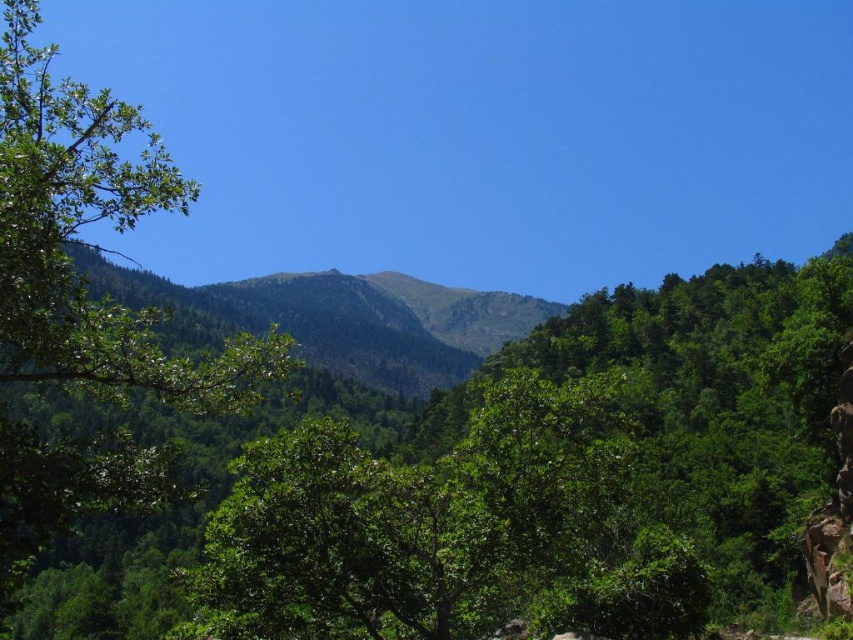
Does green leafy tree at center appear over green leafy tree at left?

Actually, green leafy tree at center is below green leafy tree at left.

Who is taller, green leafy tree at center or green leafy tree at left?

green leafy tree at left is taller.

The height and width of the screenshot is (640, 853). Identify the location of green leafy tree at center. (514, 486).